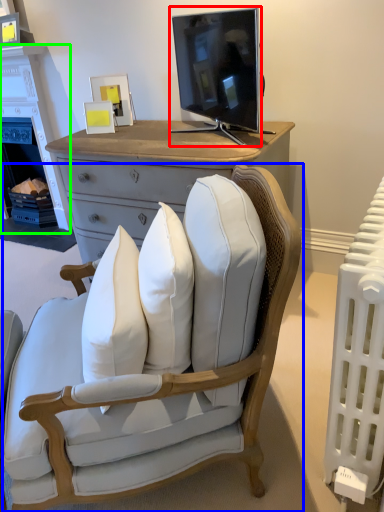
Question: Considering the real-world distances, which object is closest to television (highlighted by a red box)? chair (highlighted by a blue box) or fireplace (highlighted by a green box).

Choices:
 (A) chair
 (B) fireplace

Answer: (A)